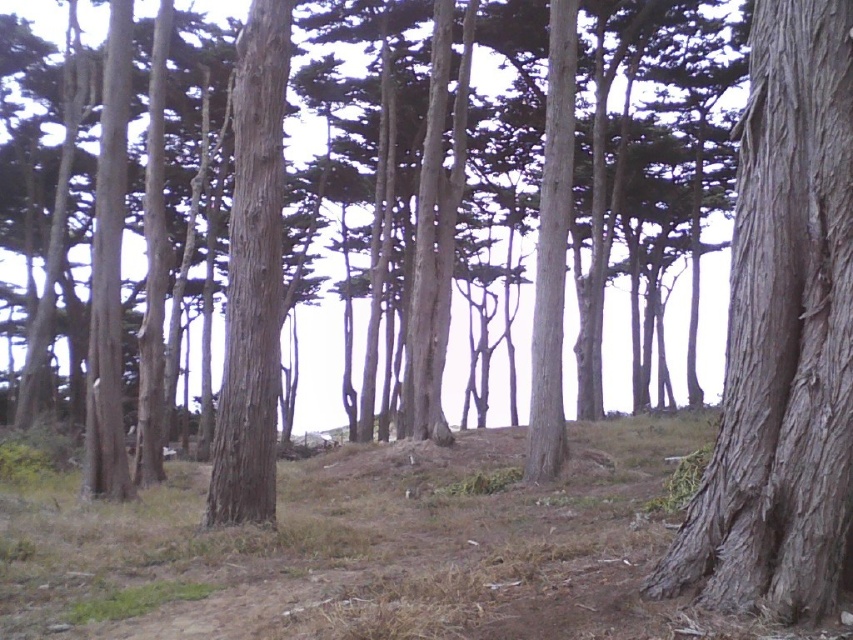
Which is in front, point (780, 298) or point (241, 218)?

Positioned in front is point (780, 298).

Does gray rough bark tree trunk at center appear under smooth brown tree trunk at center?

Correct, gray rough bark tree trunk at center is located below smooth brown tree trunk at center.

I want to click on gray rough bark tree trunk at center, so click(x=782, y=337).

Is gray rough bark tree trunk at center below smooth bark tree at center?

Yes.

Does point (775, 385) come closer to viewer compared to point (55, 20)?

That is True.

At what (x,y) coordinates should I click in order to perform the action: click on gray rough bark tree trunk at center. Please return your answer as a coordinate pair (x, y). The height and width of the screenshot is (640, 853). Looking at the image, I should click on (782, 337).

Does smooth bark tree at center have a lesser width compared to smooth brown tree trunk at center?

Incorrect, smooth bark tree at center's width is not less than smooth brown tree trunk at center's.

Does smooth bark tree at center lie behind smooth brown tree trunk at center?

Yes, smooth bark tree at center is behind smooth brown tree trunk at center.

Locate an element on the screen. smooth bark tree at center is located at coordinates (318, 368).